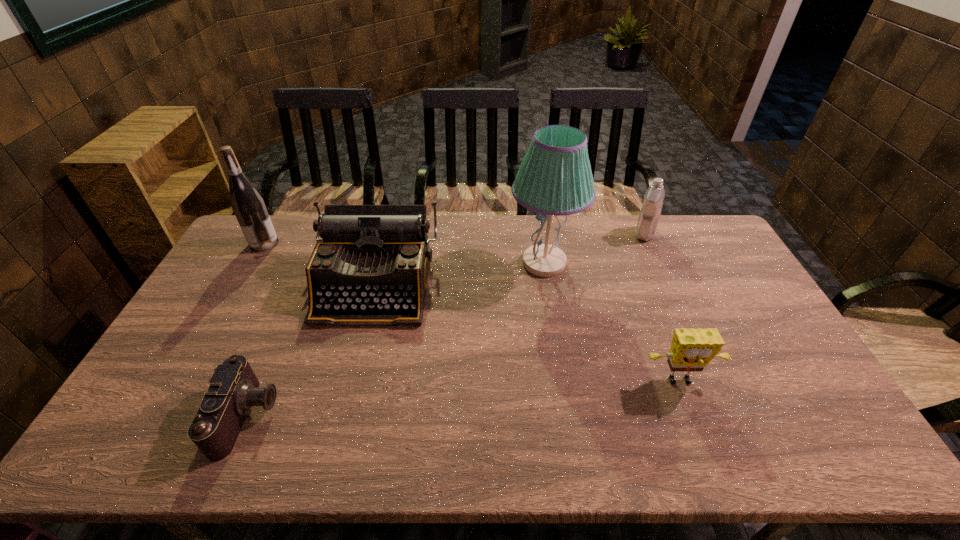
I want to click on object that is at the far left corner, so click(249, 208).

In order to click on free region at the far edge in this screenshot , I will do `click(616, 217)`.

You are a GUI agent. You are given a task and a screenshot of the screen. Output one action in this format:
    pyautogui.click(x=<x>, y=<y>)
    Task: Click on the free location at the near edge
    This screenshot has height=540, width=960.
    Given the screenshot: What is the action you would take?
    pyautogui.click(x=270, y=453)

Identify the location of free space at the left edge. (266, 270).

The width and height of the screenshot is (960, 540). Find the location of `free location at the right edge of the desktop`. free location at the right edge of the desktop is located at coordinates (692, 258).

You are a GUI agent. You are given a task and a screenshot of the screen. Output one action in this format:
    pyautogui.click(x=<x>, y=<y>)
    Task: Click on the free region at the near left corner of the desktop
    This screenshot has width=960, height=540.
    Given the screenshot: What is the action you would take?
    pyautogui.click(x=159, y=453)

Where is `free point between the second shortest object and the detergent`? Image resolution: width=960 pixels, height=540 pixels. free point between the second shortest object and the detergent is located at coordinates (662, 308).

This screenshot has height=540, width=960. I want to click on free spot between the typewriter and the camera, so click(312, 350).

At what (x,y) coordinates should I click in order to perform the action: click on free space between the fourth object from left to right and the detergent. Please return your answer as a coordinate pair (x, y). The image size is (960, 540). Looking at the image, I should click on (594, 248).

Where is `free space that is in between the shortest object and the fifth tallest object`? Image resolution: width=960 pixels, height=540 pixels. free space that is in between the shortest object and the fifth tallest object is located at coordinates (465, 399).